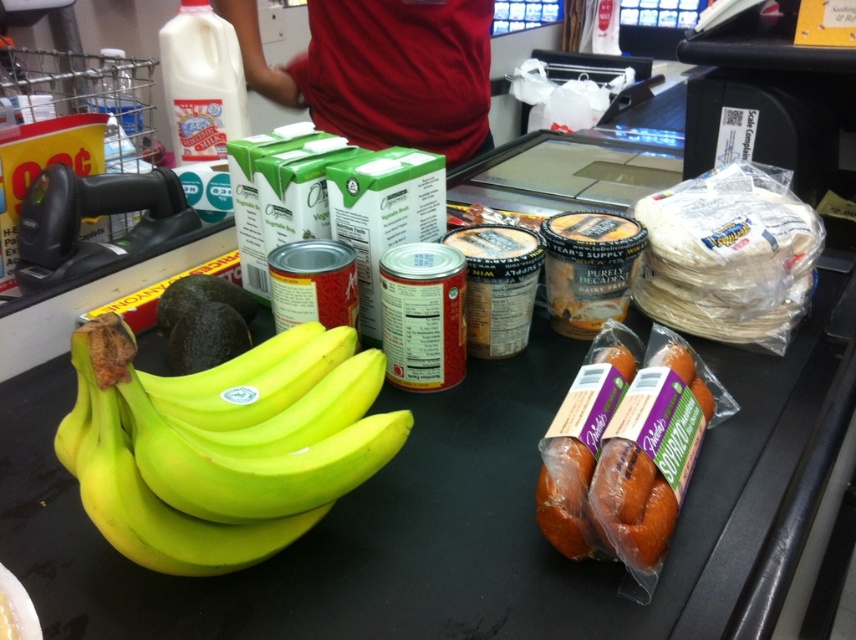
Does translucent plastic sausage at center right appear under white matte yoghurt at upper left?

Correct, translucent plastic sausage at center right is located below white matte yoghurt at upper left.

Which is more to the left, translucent plastic sausage at center right or white matte yoghurt at upper left?

From the viewer's perspective, white matte yoghurt at upper left appears more on the left side.

Locate an element on the screen. The width and height of the screenshot is (856, 640). translucent plastic sausage at center right is located at coordinates (605, 500).

Is yellow shiny bananas at left further to camera compared to translucent plastic sausage at center right?

No, it is not.

Can you confirm if yellow shiny bananas at left is smaller than translucent plastic sausage at center right?

Actually, yellow shiny bananas at left might be larger than translucent plastic sausage at center right.

Who is more forward, (165, 458) or (657, 486)?

Point (165, 458) is more forward.

Find the location of a particular element. The width and height of the screenshot is (856, 640). yellow shiny bananas at left is located at coordinates (207, 464).

Can you confirm if red smooth shirt at upper center is positioned below translucent plastic sausage at center right?

Incorrect, red smooth shirt at upper center is not positioned below translucent plastic sausage at center right.

Which of these two, red smooth shirt at upper center or translucent plastic sausage at center right, stands shorter?

translucent plastic sausage at center right

Between point (449, 74) and point (645, 541), which one is positioned behind?

The point (449, 74) is more distant.

Find the location of a particular element. The height and width of the screenshot is (640, 856). red smooth shirt at upper center is located at coordinates (383, 70).